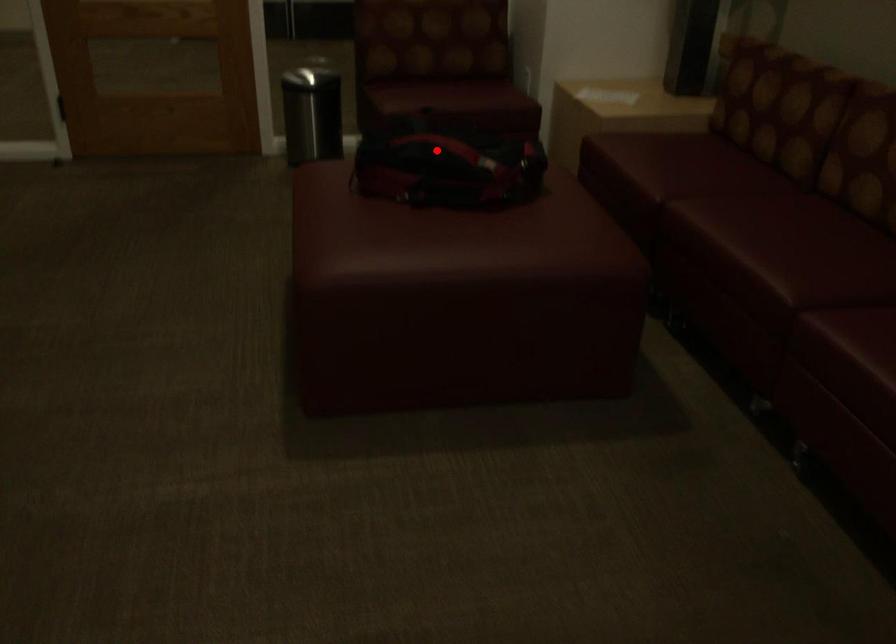
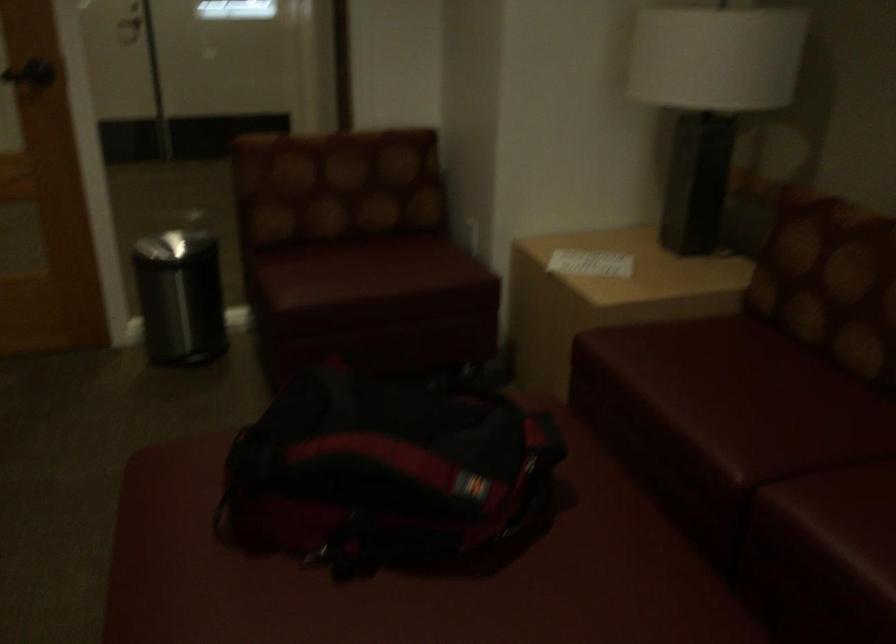
Question: A red point is marked in image1. In image2, is the corresponding 3D point closer to the camera or farther? Reply with the corresponding letter.

Choices:
 (A) The corresponding 3D point is closer.
 (B) The corresponding 3D point is farther.

Answer: (A)